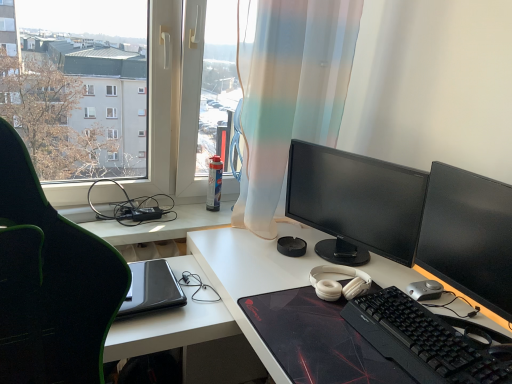
The width and height of the screenshot is (512, 384). I want to click on free spot behind black textured mousepad at center, so click(304, 259).